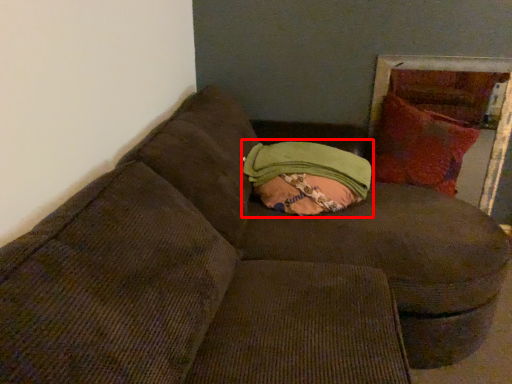
Question: From the image's perspective, what is the correct spatial relationship of bean bag chair (annotated by the red box) in relation to throw pillow?

Choices:
 (A) above
 (B) below

Answer: (B)